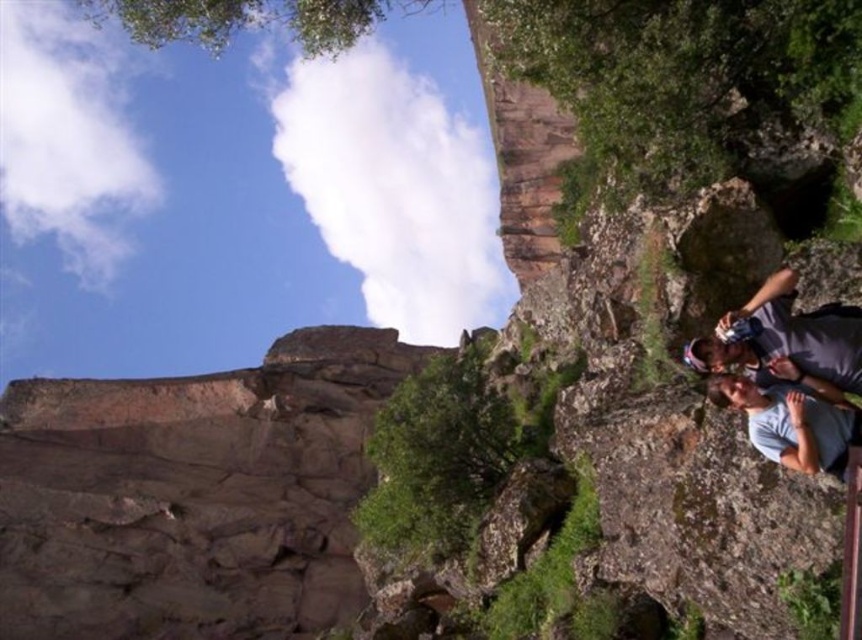
You are hiking with two friends wearing gray fabric shirt at lower right and gray cotton shirt at lower right. You want to take a photo of both of them together. Which friend should you move closer to the camera to ensure both are fully visible in the frame?

You should move the gray cotton shirt at lower right closer to the camera because the gray fabric shirt at lower right is already in front of the gray cotton shirt at lower right, so moving the latter forward would allow both to be visible without one blocking the other.